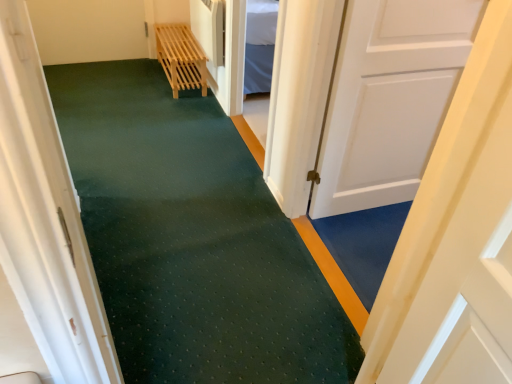
Question: Considering the relative sizes of light wood slatted bench at upper center and white matte door at center, placed as the first door when sorted from left to right, in the image provided, is light wood slatted bench at upper center wider than white matte door at center, placed as the first door when sorted from left to right,?

Choices:
 (A) yes
 (B) no

Answer: (A)

Question: Does light wood slatted bench at upper center have a smaller size compared to white matte door at center, the second door viewed from the right?

Choices:
 (A) no
 (B) yes

Answer: (B)

Question: Is light wood slatted bench at upper center beside white matte door at center, placed as the first door when sorted from left to right?

Choices:
 (A) yes
 (B) no

Answer: (B)

Question: From a real-world perspective, is light wood slatted bench at upper center positioned under white matte door at center, placed as the first door when sorted from left to right, based on gravity?

Choices:
 (A) no
 (B) yes

Answer: (B)

Question: Is white matte door at center, the second door viewed from the right, at the back of light wood slatted bench at upper center?

Choices:
 (A) no
 (B) yes

Answer: (A)

Question: From a real-world perspective, is light wood slatted bench at upper center physically located above or below white matte door at center, placed as the first door when sorted from left to right?

Choices:
 (A) below
 (B) above

Answer: (A)

Question: In terms of size, does light wood slatted bench at upper center appear bigger or smaller than white matte door at center, placed as the first door when sorted from left to right?

Choices:
 (A) big
 (B) small

Answer: (B)

Question: In the image, is light wood slatted bench at upper center positioned in front of or behind white matte door at center, placed as the first door when sorted from left to right?

Choices:
 (A) behind
 (B) front

Answer: (A)

Question: Is light wood slatted bench at upper center spatially inside white matte door at center, placed as the first door when sorted from left to right, or outside of it?

Choices:
 (A) inside
 (B) outside

Answer: (B)

Question: Considering the positions of point (415, 155) and point (432, 261), is point (415, 155) closer or farther from the camera than point (432, 261)?

Choices:
 (A) farther
 (B) closer

Answer: (A)

Question: Is white matte door at right, which is the 2th door in left-to-right order, wider or thinner than white matte door at center, the second door viewed from the right?

Choices:
 (A) wide
 (B) thin

Answer: (B)

Question: In the image, is white matte door at right, which is the 2th door in left-to-right order, positioned in front of or behind white matte door at center, placed as the first door when sorted from left to right?

Choices:
 (A) behind
 (B) front

Answer: (A)

Question: From a real-world perspective, is white matte door at right, which is the 2th door in left-to-right order, above or below white matte door at center, placed as the first door when sorted from left to right?

Choices:
 (A) above
 (B) below

Answer: (B)

Question: Is light wood slatted bench at upper center taller or shorter than white matte door at right, which is the 2th door in left-to-right order?

Choices:
 (A) tall
 (B) short

Answer: (B)

Question: In the image, is light wood slatted bench at upper center positioned in front of or behind white matte door at right, which is the 2th door in left-to-right order?

Choices:
 (A) behind
 (B) front

Answer: (A)